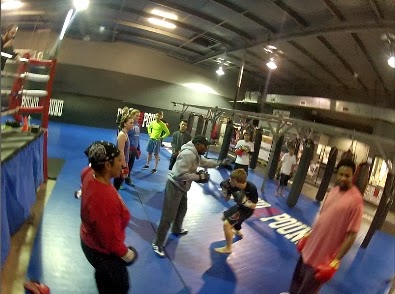
Find the location of `mats`. mats is located at coordinates (259, 271), (293, 218), (84, 138), (72, 229).